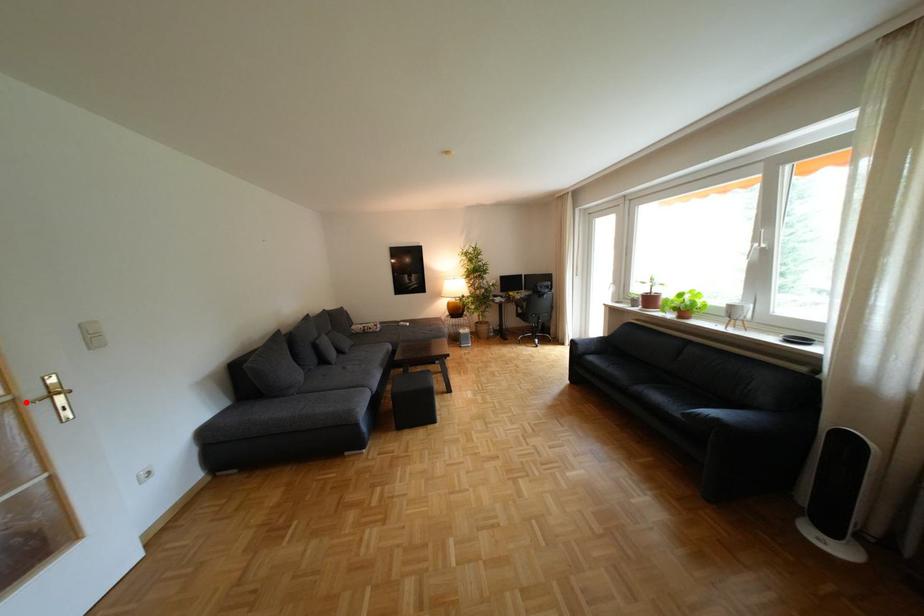
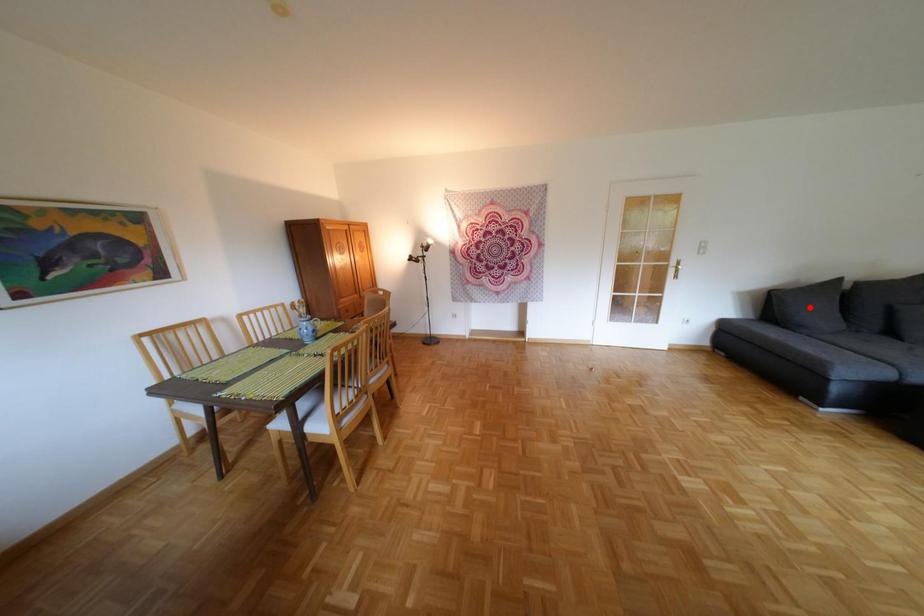
I am providing you with two images of the same scene from different viewpoints. A red point is marked on the first image and another point is marked on the second image. Is the red point in image1 aligned with the point shown in image2?

No